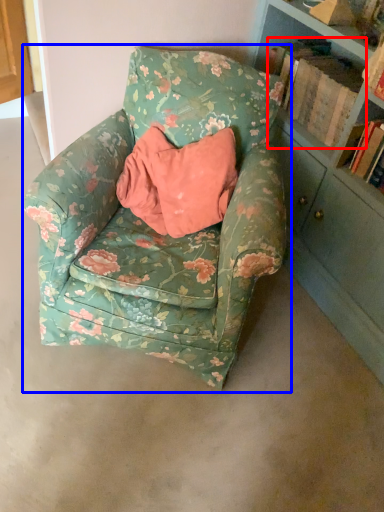
Question: Which point is further to the camera, book (highlighted by a red box) or chair (highlighted by a blue box)?

Choices:
 (A) book
 (B) chair

Answer: (A)